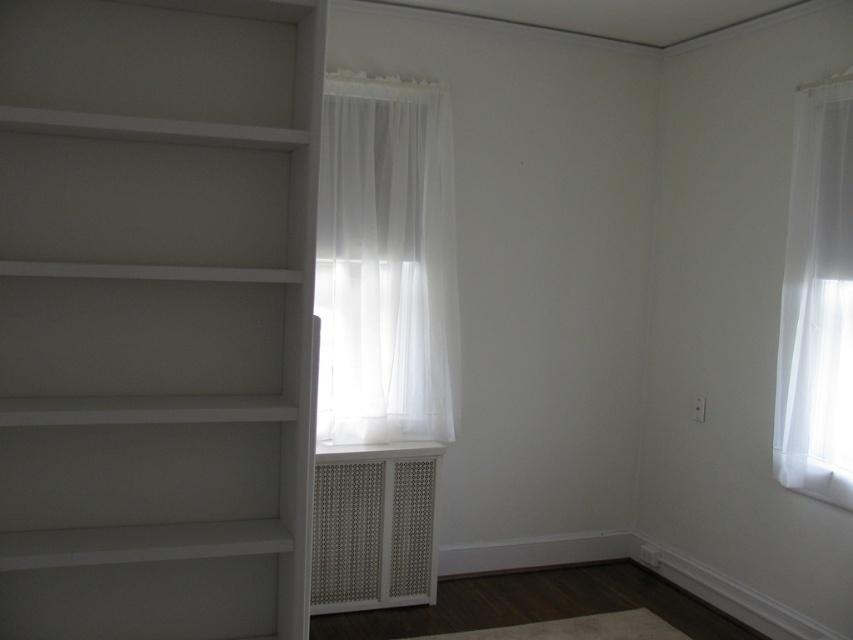
Between point (20, 483) and point (421, 116), which one is positioned in front?

Point (20, 483)

Describe the element at coordinates (154, 314) in the screenshot. The height and width of the screenshot is (640, 853). I see `white painted wood bookshelf at left` at that location.

Locate an element on the screen. This screenshot has width=853, height=640. white painted wood bookshelf at left is located at coordinates (154, 314).

Is sheer white curtain at center shorter than white textured vent at center?

In fact, sheer white curtain at center may be taller than white textured vent at center.

Between point (323, 416) and point (408, 602), which one is positioned behind?

The point (323, 416) is behind.

Image resolution: width=853 pixels, height=640 pixels. I want to click on sheer white curtain at center, so click(x=386, y=262).

Who is taller, sheer white curtain at center or sheer white curtain at right?

sheer white curtain at right is taller.

Can you confirm if sheer white curtain at center is taller than sheer white curtain at right?

No, sheer white curtain at center is not taller than sheer white curtain at right.

Locate an element on the screen. sheer white curtain at center is located at coordinates (386, 262).